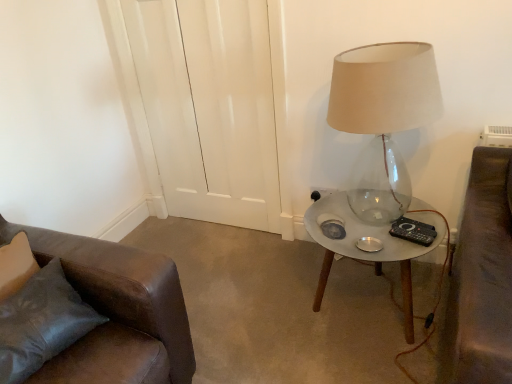
Question: Does point (371, 117) appear closer or farther from the camera than point (90, 342)?

Choices:
 (A) closer
 (B) farther

Answer: (B)

Question: From a real-world perspective, is translucent glass lamp at right physically located above or below leather couch at lower left?

Choices:
 (A) below
 (B) above

Answer: (B)

Question: Which object is positioned farthest from the black plastic remote control at right?

Choices:
 (A) metallic glass table at right
 (B) leather couch at lower left
 (C) black plastic socket at lower right
 (D) translucent glass lamp at right

Answer: (B)

Question: Considering the real-world distances, which object is closest to the leather couch at lower left?

Choices:
 (A) black plastic socket at lower right
 (B) black plastic remote control at right
 (C) metallic glass table at right
 (D) translucent glass lamp at right

Answer: (C)